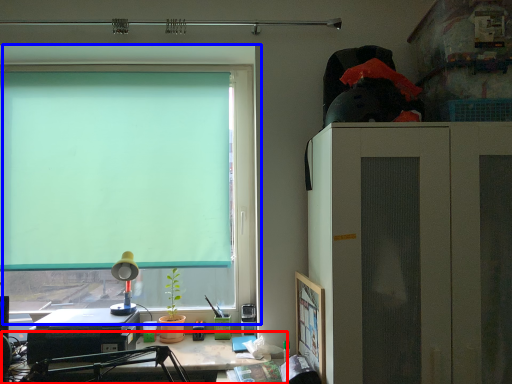
Question: Which object appears closest to the camera in this image, desk (highlighted by a red box) or window (highlighted by a blue box)?

Choices:
 (A) desk
 (B) window

Answer: (A)